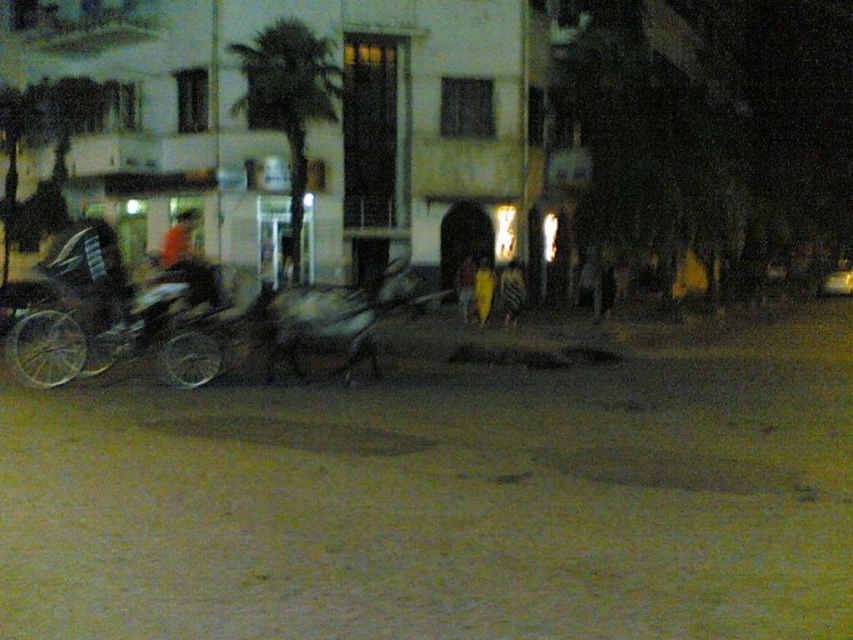
How far apart are green leafy palm tree at center and dark fabric shirt at center?

green leafy palm tree at center is 24.11 feet from dark fabric shirt at center.

Which is in front, point (312, 51) or point (207, 269)?

Positioned in front is point (207, 269).

This screenshot has height=640, width=853. What are the coordinates of `green leafy palm tree at center` in the screenshot? It's located at (288, 99).

Locate an element on the screen. green leafy palm tree at center is located at coordinates (288, 99).